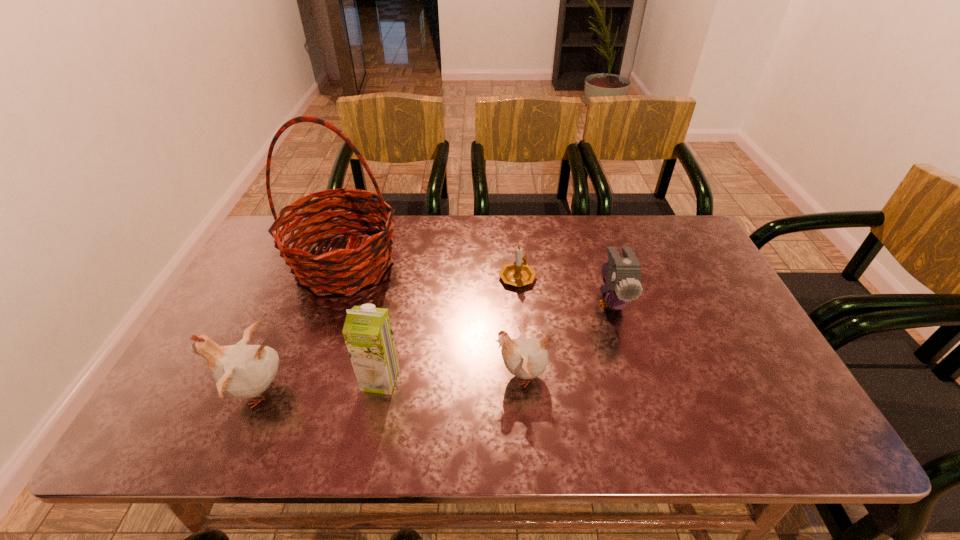
This screenshot has width=960, height=540. Find the location of `blank area located at the beak of the second bird from right to left`. blank area located at the beak of the second bird from right to left is located at coordinates (334, 375).

Locate an element on the screen. The image size is (960, 540). vacant point located at the beak of the second bird from right to left is located at coordinates (397, 375).

Where is `vacant point located at the beak of the second bird from right to left`? This screenshot has height=540, width=960. vacant point located at the beak of the second bird from right to left is located at coordinates (422, 375).

In order to click on free space located at the beak of the rightmost bird in this screenshot , I will do point(629,357).

Where is `vacant space situated on the right of the tallest object`? This screenshot has width=960, height=540. vacant space situated on the right of the tallest object is located at coordinates (459, 263).

This screenshot has height=540, width=960. I want to click on vacant region located on the left of the candle holder, so click(x=418, y=276).

The image size is (960, 540). In order to click on vacant space located on the right of the second tallest object in this screenshot , I will do `click(474, 380)`.

At what (x,y) coordinates should I click in order to perform the action: click on object that is positioned at the far edge. Please return your answer as a coordinate pair (x, y). This screenshot has width=960, height=540. Looking at the image, I should click on (363, 263).

At what (x,y) coordinates should I click in order to perform the action: click on soya milk that is at the near edge. Please return your answer as a coordinate pair (x, y). This screenshot has height=540, width=960. Looking at the image, I should click on (367, 331).

The width and height of the screenshot is (960, 540). What are the coordinates of `bird located at the left edge` in the screenshot? It's located at (244, 371).